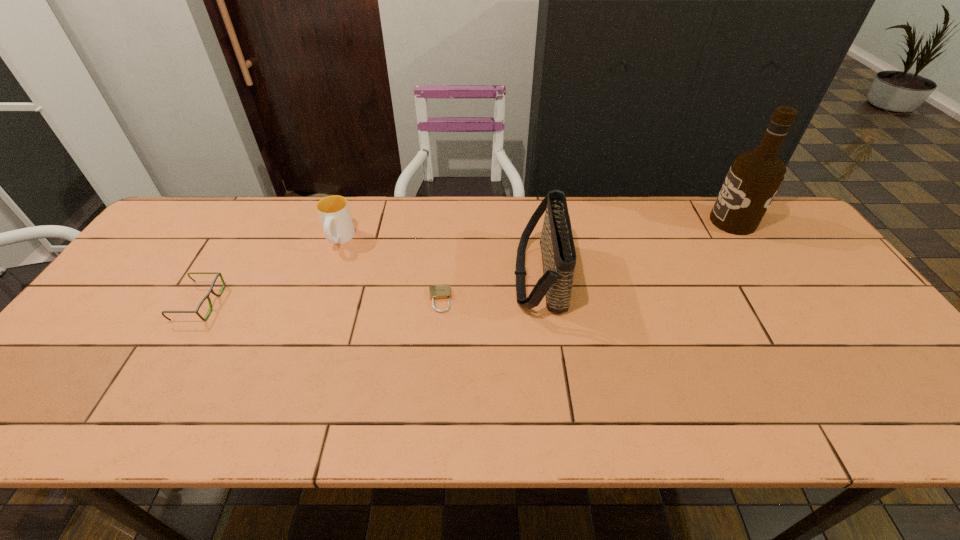
Identify the location of free point that satisfies the following two spatial constraints: 1. with the handle on the side of the padlock; 2. on the left side of the cup. (318, 300).

What are the coordinates of `vacant space that satisfies the following two spatial constraints: 1. with the handle on the side of the third shortest object; 2. on the right side of the fourth shortest object` in the screenshot? It's located at (325, 276).

Image resolution: width=960 pixels, height=540 pixels. What are the coordinates of `blank area in the image that satisfies the following two spatial constraints: 1. on the label of the rightmost object; 2. with the handle on the side of the second object from left to right` in the screenshot? It's located at (745, 240).

At what (x,y) coordinates should I click in order to perform the action: click on vacant space that satisfies the following two spatial constraints: 1. on the label of the alcohol; 2. on the front side of the fourth shortest object. Please return your answer as a coordinate pair (x, y). Looking at the image, I should click on (769, 276).

I want to click on vacant position in the image that satisfies the following two spatial constraints: 1. on the label of the tallest object; 2. with the handle on the side of the second object from left to right, so click(745, 240).

Where is `vacant space that satisfies the following two spatial constraints: 1. with the handle on the side of the cup; 2. on the right side of the handbag`? vacant space that satisfies the following two spatial constraints: 1. with the handle on the side of the cup; 2. on the right side of the handbag is located at coordinates (325, 276).

Locate an element on the screen. This screenshot has height=540, width=960. vacant region that satisfies the following two spatial constraints: 1. with the handle on the side of the cup; 2. on the left side of the fourth shortest object is located at coordinates (325, 276).

This screenshot has height=540, width=960. I want to click on vacant space that satisfies the following two spatial constraints: 1. on the front side of the third object from left to right; 2. on the lens of the leftmost object, so 440,303.

The image size is (960, 540). I want to click on vacant space that satisfies the following two spatial constraints: 1. on the label of the rightmost object; 2. with the handle on the side of the second object from left to right, so click(x=745, y=240).

Where is `vacant space that satisfies the following two spatial constraints: 1. with the handle on the side of the cup; 2. on the right side of the third object from right to left`? vacant space that satisfies the following two spatial constraints: 1. with the handle on the side of the cup; 2. on the right side of the third object from right to left is located at coordinates pos(318,300).